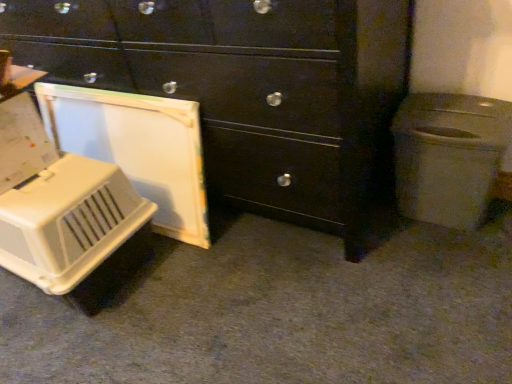
Where is `vacant space positioned to the left of white plastic trash can at right`? Image resolution: width=512 pixels, height=384 pixels. vacant space positioned to the left of white plastic trash can at right is located at coordinates (387, 234).